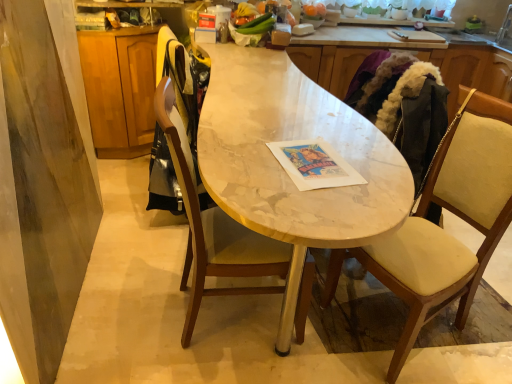
What is the approximate height of marble table at center?

34.33 inches.

The width and height of the screenshot is (512, 384). Describe the element at coordinates (441, 228) in the screenshot. I see `beige fabric chair at right, the second chair from the left` at that location.

You are a GUI agent. You are given a task and a screenshot of the screen. Output one action in this format:
    pyautogui.click(x=<x>, y=<y>)
    Task: Click on the white marble countertop at center
    This screenshot has height=384, width=512.
    Given the screenshot: What is the action you would take?
    pyautogui.click(x=290, y=139)

The image size is (512, 384). What do you see at coordinates (290, 139) in the screenshot?
I see `white marble countertop at center` at bounding box center [290, 139].

Locate an element on the screen. This screenshot has width=512, height=384. marble table at center is located at coordinates (284, 170).

Considering the relative positions of light brown wood cabinet at upper right, acting as the first cabinetry starting from the right, and wooden chair at center, arranged as the first chair when viewed from the left, in the image provided, is light brown wood cabinet at upper right, acting as the first cabinetry starting from the right, to the left or to the right of wooden chair at center, arranged as the first chair when viewed from the left,?

light brown wood cabinet at upper right, acting as the first cabinetry starting from the right, is to the right of wooden chair at center, arranged as the first chair when viewed from the left.

Is light brown wood cabinet at upper right, which is counted as the 2th cabinetry, starting from the left, further to the viewer compared to wooden chair at center, arranged as the first chair when viewed from the left?

Yes, light brown wood cabinet at upper right, which is counted as the 2th cabinetry, starting from the left, is further from the viewer.

How many degrees apart are the facing directions of light brown wood cabinet at upper right, acting as the first cabinetry starting from the right, and wooden chair at center, arranged as the first chair when viewed from the left?

light brown wood cabinet at upper right, acting as the first cabinetry starting from the right, and wooden chair at center, arranged as the first chair when viewed from the left, are facing 179 degrees away from each other.

Do you think light brown wood cabinet at upper right, acting as the first cabinetry starting from the right, is within wooden chair at center, arranged as the first chair when viewed from the left, or outside of it?

light brown wood cabinet at upper right, acting as the first cabinetry starting from the right, is not enclosed by wooden chair at center, arranged as the first chair when viewed from the left.

Can we say wooden chair at center, arranged as the first chair when viewed from the left, lies outside silver metallic faucet at upper right?

Yes, wooden chair at center, arranged as the first chair when viewed from the left, is located beyond the bounds of silver metallic faucet at upper right.

Is wooden chair at center, the 2th chair when ordered from right to left, aimed at silver metallic faucet at upper right?

No, wooden chair at center, the 2th chair when ordered from right to left, is not facing towards silver metallic faucet at upper right.

From the image's perspective, is wooden chair at center, the 2th chair when ordered from right to left, located above or below silver metallic faucet at upper right?

wooden chair at center, the 2th chair when ordered from right to left, is below silver metallic faucet at upper right.

Between wooden chair at center, arranged as the first chair when viewed from the left, and silver metallic faucet at upper right, which one is positioned in front?

wooden chair at center, arranged as the first chair when viewed from the left.

Based on the photo, which of these two, white marble countertop at center or silver metallic faucet at upper right, is bigger?

white marble countertop at center is bigger.

You are a GUI agent. You are given a task and a screenshot of the screen. Output one action in this format:
    pyautogui.click(x=<x>, y=<y>)
    Task: Click on the countertop below the silver metallic faucet at upper right (from the image's perspective)
    Image resolution: width=512 pixels, height=384 pixels.
    Given the screenshot: What is the action you would take?
    pyautogui.click(x=290, y=139)

Does white marble countertop at center lie in front of silver metallic faucet at upper right?

Yes, white marble countertop at center is closer to the camera.

Is point (289, 241) farther from viewer compared to point (508, 11)?

No, (289, 241) is in front of (508, 11).

Looking at this image, is beige fabric chair at right, the second chair from the left, closer to the viewer compared to silver metallic faucet at upper right?

Yes, it is in front of silver metallic faucet at upper right.

Considering the positions of points (465, 197) and (510, 14), is point (465, 197) farther from camera compared to point (510, 14)?

No.

Considering the relative sizes of beige fabric chair at right, which is the 1th chair in right-to-left order, and silver metallic faucet at upper right in the image provided, is beige fabric chair at right, which is the 1th chair in right-to-left order, taller than silver metallic faucet at upper right?

Correct, beige fabric chair at right, which is the 1th chair in right-to-left order, is much taller as silver metallic faucet at upper right.

Could you tell me if beige fabric chair at right, the second chair from the left, is facing silver metallic faucet at upper right?

No, beige fabric chair at right, the second chair from the left, is not turned towards silver metallic faucet at upper right.

The width and height of the screenshot is (512, 384). I want to click on chair to the left of marble table at center, so click(213, 226).

From the image's perspective, which object appears higher, wooden chair at center, arranged as the first chair when viewed from the left, or marble table at center?

From the image's view, marble table at center is above.

Is wooden chair at center, the 2th chair when ordered from right to left, aimed at marble table at center?

Yes, wooden chair at center, the 2th chair when ordered from right to left, faces towards marble table at center.

Are wooden chair at center, the 2th chair when ordered from right to left, and marble table at center located far from each other?

wooden chair at center, the 2th chair when ordered from right to left, is actually quite close to marble table at center.

Is wooden cabinet at left, marked as the first cabinetry in a left-to-right arrangement, not inside wooden chair at center, arranged as the first chair when viewed from the left?

Absolutely, wooden cabinet at left, marked as the first cabinetry in a left-to-right arrangement, is external to wooden chair at center, arranged as the first chair when viewed from the left.

Measure the distance from wooden cabinet at left, which is the second cabinetry from right to left, to wooden chair at center, arranged as the first chair when viewed from the left.

wooden cabinet at left, which is the second cabinetry from right to left, and wooden chair at center, arranged as the first chair when viewed from the left, are 1.26 meters apart from each other.

Is wooden cabinet at left, marked as the first cabinetry in a left-to-right arrangement, shorter than wooden chair at center, arranged as the first chair when viewed from the left?

Yes.

Is wooden cabinet at left, which is the second cabinetry from right to left, with wooden chair at center, arranged as the first chair when viewed from the left?

There is a gap between wooden cabinet at left, which is the second cabinetry from right to left, and wooden chair at center, arranged as the first chair when viewed from the left.

Considering the sizes of objects light brown wood cabinet at upper right, acting as the first cabinetry starting from the right, and white marble countertop at center in the image provided, who is bigger, light brown wood cabinet at upper right, acting as the first cabinetry starting from the right, or white marble countertop at center?

white marble countertop at center is bigger.

From the image's perspective, is light brown wood cabinet at upper right, which is counted as the 2th cabinetry, starting from the left, positioned above or below white marble countertop at center?

light brown wood cabinet at upper right, which is counted as the 2th cabinetry, starting from the left, is above white marble countertop at center.

Choose the correct answer: Is light brown wood cabinet at upper right, acting as the first cabinetry starting from the right, inside white marble countertop at center or outside it?

light brown wood cabinet at upper right, acting as the first cabinetry starting from the right, lies outside white marble countertop at center.

Find the location of `cabinetry that appears above the white marble countertop at center (from a real-world perspective)`. cabinetry that appears above the white marble countertop at center (from a real-world perspective) is located at coordinates (476, 72).

Which chair is the 1st one when counting from the front of the light brown wood cabinet at upper right, which is counted as the 2th cabinetry, starting from the left? Please provide its 2D coordinates.

[(213, 226)]

Where is `faucet on the right of wooden chair at center, arranged as the first chair when viewed from the left`? faucet on the right of wooden chair at center, arranged as the first chair when viewed from the left is located at coordinates (x=505, y=26).

Considering their positions, is wooden cabinet at left, marked as the first cabinetry in a left-to-right arrangement, positioned further to wooden chair at center, arranged as the first chair when viewed from the left, than silver metallic faucet at upper right?

Among the two, silver metallic faucet at upper right is located further to wooden chair at center, arranged as the first chair when viewed from the left.

Considering their positions, is wooden cabinet at left, marked as the first cabinetry in a left-to-right arrangement, positioned further to wooden chair at center, the 2th chair when ordered from right to left, than marble table at center?

wooden cabinet at left, marked as the first cabinetry in a left-to-right arrangement, is further to wooden chair at center, the 2th chair when ordered from right to left.

From the picture: Which object lies nearer to the anchor point silver metallic faucet at upper right, wooden chair at center, arranged as the first chair when viewed from the left, or light brown wood cabinet at upper right, which is counted as the 2th cabinetry, starting from the left?

light brown wood cabinet at upper right, which is counted as the 2th cabinetry, starting from the left.

Estimate the real-world distances between objects in this image. Which object is closer to marble table at center, silver metallic faucet at upper right or wooden chair at center, arranged as the first chair when viewed from the left?

wooden chair at center, arranged as the first chair when viewed from the left, is closer to marble table at center.

From the image, which object appears to be nearer to marble table at center, silver metallic faucet at upper right or white marble countertop at center?

white marble countertop at center.

Based on their spatial positions, is wooden chair at center, the 2th chair when ordered from right to left, or white marble countertop at center further from beige fabric chair at right, the second chair from the left?

Based on the image, white marble countertop at center appears to be further to beige fabric chair at right, the second chair from the left.

When comparing their distances from silver metallic faucet at upper right, does marble table at center or wooden cabinet at left, which is the second cabinetry from right to left, seem further?

wooden cabinet at left, which is the second cabinetry from right to left.

Consider the image. From the image, which object appears to be nearer to white marble countertop at center, wooden chair at center, the 2th chair when ordered from right to left, or wooden cabinet at left, marked as the first cabinetry in a left-to-right arrangement?

Among the two, wooden chair at center, the 2th chair when ordered from right to left, is located nearer to white marble countertop at center.

Where is `countertop between wooden cabinet at left, marked as the first cabinetry in a left-to-right arrangement, and light brown wood cabinet at upper right, which is counted as the 2th cabinetry, starting from the left, from left to right`? This screenshot has width=512, height=384. countertop between wooden cabinet at left, marked as the first cabinetry in a left-to-right arrangement, and light brown wood cabinet at upper right, which is counted as the 2th cabinetry, starting from the left, from left to right is located at coordinates (290, 139).

This screenshot has width=512, height=384. I want to click on countertop between wooden chair at center, arranged as the first chair when viewed from the left, and silver metallic faucet at upper right, in the horizontal direction, so click(290, 139).

Image resolution: width=512 pixels, height=384 pixels. Identify the location of countertop located between wooden chair at center, the 2th chair when ordered from right to left, and light brown wood cabinet at upper right, which is counted as the 2th cabinetry, starting from the left, in the left-right direction. (290, 139).

You are a GUI agent. You are given a task and a screenshot of the screen. Output one action in this format:
    pyautogui.click(x=<x>, y=<y>)
    Task: Click on the round table between wooden cabinet at left, marked as the first cabinetry in a left-to-right arrangement, and silver metallic faucet at upper right from left to right
    This screenshot has width=512, height=384.
    Given the screenshot: What is the action you would take?
    pyautogui.click(x=284, y=170)